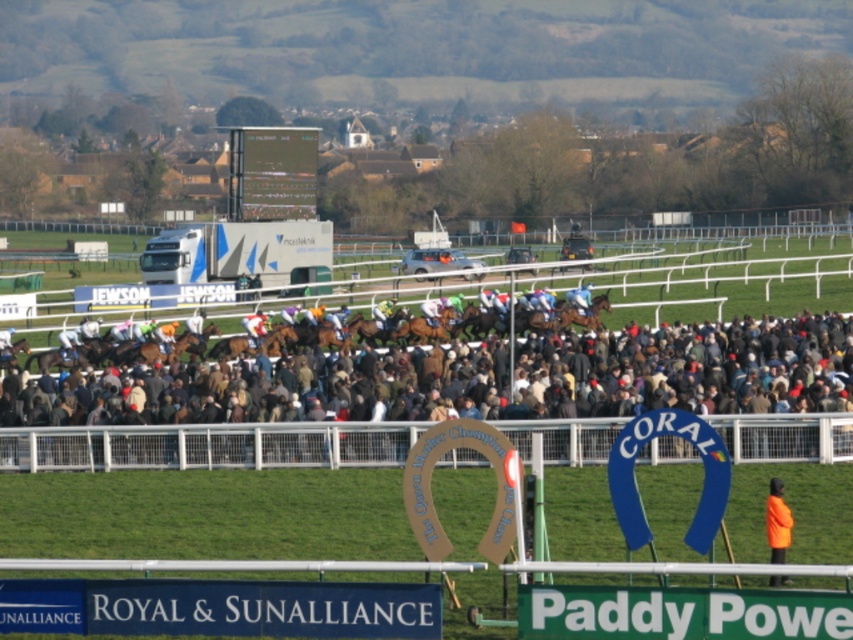
Question: Can you confirm if brown woolen coat at center is smaller than orange reflective jacket at lower right?

Choices:
 (A) no
 (B) yes

Answer: (A)

Question: Among these points, which one is farthest from the camera?

Choices:
 (A) (782, 561)
 (B) (839, 436)

Answer: (B)

Question: Which of the following is the farthest from the observer?

Choices:
 (A) brown woolen coat at center
 (B) orange reflective jacket at lower right

Answer: (B)

Question: Is brown woolen coat at center to the right of orange reflective jacket at lower right from the viewer's perspective?

Choices:
 (A) yes
 (B) no

Answer: (B)

Question: Can you confirm if brown woolen coat at center is wider than orange reflective jacket at lower right?

Choices:
 (A) no
 (B) yes

Answer: (B)

Question: Which point is farther to the camera?

Choices:
 (A) 363,428
 (B) 770,518

Answer: (A)